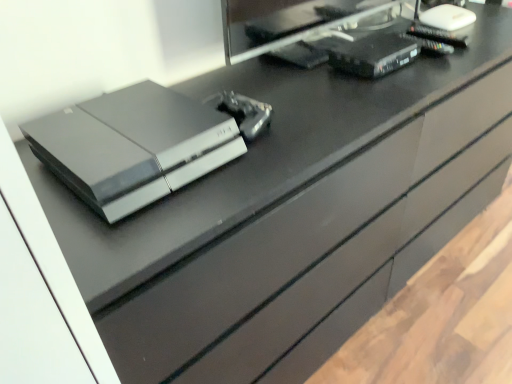
Identify the location of vacant space behind metallic silver controller at center, the second equipment from the right. The image size is (512, 384). (254, 83).